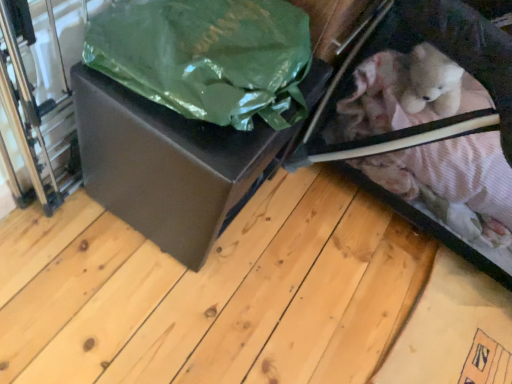
Find the location of a particular element. This screenshot has width=512, height=384. green matte plastic bag at upper left is located at coordinates (207, 57).

Where is `matte black box at center`? matte black box at center is located at coordinates 168,165.

You are a GUI agent. You are given a task and a screenshot of the screen. Output one action in this format:
    pyautogui.click(x=<x>, y=<y>)
    Task: Click on the green matte plastic bag at upper left
    
    Given the screenshot: What is the action you would take?
    pyautogui.click(x=207, y=57)

Could you tell me if green matte plastic bag at upper left is facing velvet pink fabric baby carriage at lower right?

No, green matte plastic bag at upper left is not oriented towards velvet pink fabric baby carriage at lower right.

Considering the relative positions of green matte plastic bag at upper left and velvet pink fabric baby carriage at lower right in the image provided, is green matte plastic bag at upper left to the left of velvet pink fabric baby carriage at lower right from the viewer's perspective?

Yes.

Can you confirm if green matte plastic bag at upper left is bigger than velvet pink fabric baby carriage at lower right?

No.

In terms of width, does velvet pink fabric baby carriage at lower right look wider or thinner when compared to matte black box at center?

Considering their sizes, velvet pink fabric baby carriage at lower right looks broader than matte black box at center.

Based on the photo, could you tell me if velvet pink fabric baby carriage at lower right is turned towards matte black box at center?

No, velvet pink fabric baby carriage at lower right is not facing towards matte black box at center.

Does velvet pink fabric baby carriage at lower right have a smaller size compared to matte black box at center?

→ No.

From the picture: From their relative heights in the image, would you say velvet pink fabric baby carriage at lower right is taller or shorter than matte black box at center?

velvet pink fabric baby carriage at lower right is taller than matte black box at center.

Is green matte plastic bag at upper left oriented away from matte black box at center?

green matte plastic bag at upper left does not have its back to matte black box at center.

Is green matte plastic bag at upper left thinner than matte black box at center?

Indeed, green matte plastic bag at upper left has a lesser width compared to matte black box at center.

Between green matte plastic bag at upper left and matte black box at center, which one appears on the right side from the viewer's perspective?

green matte plastic bag at upper left is more to the right.

Which point is more forward, (387, 99) or (196, 54)?

The point (196, 54) is more forward.

Which object is closer to the camera taking this photo, velvet pink fabric baby carriage at lower right or green matte plastic bag at upper left?

green matte plastic bag at upper left is closer to the camera.

Is velvet pink fabric baby carriage at lower right oriented towards green matte plastic bag at upper left?

No, velvet pink fabric baby carriage at lower right is not aimed at green matte plastic bag at upper left.

Which object is wider, matte black box at center or velvet pink fabric baby carriage at lower right?

Wider between the two is velvet pink fabric baby carriage at lower right.

Is matte black box at center oriented towards velvet pink fabric baby carriage at lower right?

No, matte black box at center is not facing towards velvet pink fabric baby carriage at lower right.

Are matte black box at center and velvet pink fabric baby carriage at lower right beside each other?

There is a gap between matte black box at center and velvet pink fabric baby carriage at lower right.

You are a GUI agent. You are given a task and a screenshot of the screen. Output one action in this format:
    pyautogui.click(x=<x>, y=<y>)
    Task: Click on the plastic bag on the right of matte black box at center
    
    Given the screenshot: What is the action you would take?
    pyautogui.click(x=207, y=57)

Based on the photo, can you confirm if matte black box at center is positioned to the left of green matte plastic bag at upper left?

Yes, matte black box at center is to the left of green matte plastic bag at upper left.

Is matte black box at center touching green matte plastic bag at upper left?

matte black box at center and green matte plastic bag at upper left are not in contact.

The image size is (512, 384). In the image, there is a velvet pink fabric baby carriage at lower right. Identify the location of plastic bag above it (from the image's perspective). (207, 57).

What are the coordinates of `baby carriage lying in front of the matte black box at center` in the screenshot? It's located at (426, 125).

Considering their positions, is velvet pink fabric baby carriage at lower right positioned further to matte black box at center than green matte plastic bag at upper left?

velvet pink fabric baby carriage at lower right lies further to matte black box at center than the other object.

Considering their positions, is green matte plastic bag at upper left positioned closer to matte black box at center than velvet pink fabric baby carriage at lower right?

green matte plastic bag at upper left is closer to matte black box at center.

Based on their spatial positions, is matte black box at center or velvet pink fabric baby carriage at lower right closer to green matte plastic bag at upper left?

matte black box at center is positioned closer to the anchor green matte plastic bag at upper left.

From the image, which object appears to be farther from green matte plastic bag at upper left, velvet pink fabric baby carriage at lower right or matte black box at center?

velvet pink fabric baby carriage at lower right is further to green matte plastic bag at upper left.

Which object lies further to the anchor point velvet pink fabric baby carriage at lower right, matte black box at center or green matte plastic bag at upper left?

green matte plastic bag at upper left lies further to velvet pink fabric baby carriage at lower right than the other object.

In the scene shown: Considering their positions, is green matte plastic bag at upper left positioned further to velvet pink fabric baby carriage at lower right than matte black box at center?

Among the two, green matte plastic bag at upper left is located further to velvet pink fabric baby carriage at lower right.

Locate an element on the screen. Image resolution: width=512 pixels, height=384 pixels. plastic bag situated between matte black box at center and velvet pink fabric baby carriage at lower right from left to right is located at coordinates (207, 57).